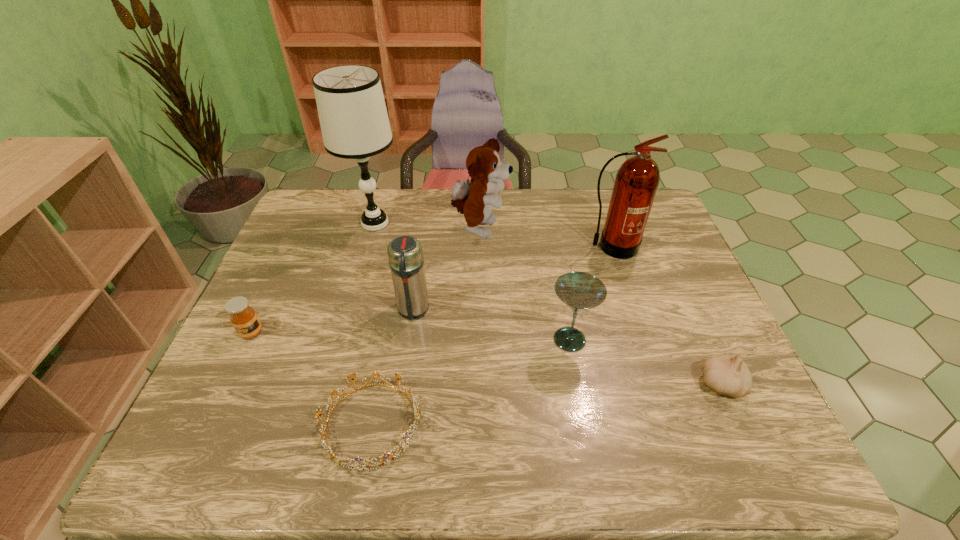
At what (x,y) coordinates should I click in order to perform the action: click on vacant area that satisfies the following two spatial constraints: 1. on the front-facing side of the martini; 2. on the right side of the leftmost object. Please return your answer as a coordinate pair (x, y). The height and width of the screenshot is (540, 960). Looking at the image, I should click on (249, 340).

You are a GUI agent. You are given a task and a screenshot of the screen. Output one action in this format:
    pyautogui.click(x=<x>, y=<y>)
    Task: Click on the free space that satisfies the following two spatial constraints: 1. on the face of the third tallest object; 2. on the right side of the fifth tallest object
    This screenshot has height=540, width=960.
    Given the screenshot: What is the action you would take?
    point(480,340)

I want to click on free space that satisfies the following two spatial constraints: 1. on the face of the puppy; 2. on the right side of the garlic, so click(480, 384).

In order to click on free location that satisfies the following two spatial constraints: 1. with a handle on the side of the fourth shortest object; 2. on the left side of the fourth tallest object in this screenshot , I will do `click(409, 340)`.